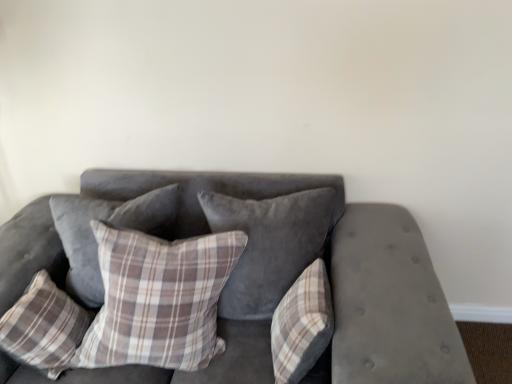
What do you see at coordinates (302, 325) in the screenshot? I see `plaid fabric pillow at center, positioned as the 1th pillow in right-to-left order` at bounding box center [302, 325].

The width and height of the screenshot is (512, 384). What do you see at coordinates (109, 225) in the screenshot?
I see `plaid fabric pillow at center, acting as the fourth pillow starting from the right` at bounding box center [109, 225].

What is the approximate height of velvet gray pillow at center, which is the fourth pillow from left to right?

The height of velvet gray pillow at center, which is the fourth pillow from left to right, is 44.44 centimeters.

The image size is (512, 384). Find the location of `plaid fabric pillow at center, the fifth pillow positioned from the left`. plaid fabric pillow at center, the fifth pillow positioned from the left is located at coordinates (302, 325).

From a real-world perspective, who is located lower, plaid fabric pillow at center, which appears as the 3th pillow when viewed from the left, or plaid fabric pillow at center, positioned as the 1th pillow in right-to-left order?

plaid fabric pillow at center, positioned as the 1th pillow in right-to-left order, from a real-world perspective.

Who is shorter, plaid fabric pillow at center, which is counted as the 3th pillow, starting from the right, or plaid fabric pillow at center, the fifth pillow positioned from the left?

plaid fabric pillow at center, the fifth pillow positioned from the left.

Is point (109, 306) closer or farther from the camera than point (278, 351)?

Point (109, 306) appears to be closer to the viewer than point (278, 351).

Are plaid fabric pillow at center, which is counted as the 3th pillow, starting from the right, and plaid fabric pillow at center, the fifth pillow positioned from the left, far apart?

They are positioned close to each other.

How much distance is there between velvet gray pillow at center, which is the fourth pillow from left to right, and plaid fabric pillow at center, which is the second pillow from left to right?

velvet gray pillow at center, which is the fourth pillow from left to right, is 15.20 inches away from plaid fabric pillow at center, which is the second pillow from left to right.

Does velvet gray pillow at center, the 2th pillow in the right-to-left sequence, have a smaller size compared to plaid fabric pillow at center, which is the second pillow from left to right?

Actually, velvet gray pillow at center, the 2th pillow in the right-to-left sequence, might be larger than plaid fabric pillow at center, which is the second pillow from left to right.

Would you say velvet gray pillow at center, which is the fourth pillow from left to right, is to the left or to the right of plaid fabric pillow at center, which is the second pillow from left to right, in the picture?

From the image, it's evident that velvet gray pillow at center, which is the fourth pillow from left to right, is to the right of plaid fabric pillow at center, which is the second pillow from left to right.

Where is `pillow that appears behind the velvet gray pillow at center, which is the fourth pillow from left to right`? Image resolution: width=512 pixels, height=384 pixels. pillow that appears behind the velvet gray pillow at center, which is the fourth pillow from left to right is located at coordinates (109, 225).

The width and height of the screenshot is (512, 384). In order to click on the 2nd pillow counting from the left of the velvet gray pillow at center, the 2th pillow in the right-to-left sequence in this screenshot , I will do `click(109, 225)`.

Which object is further away from the camera taking this photo, plaid fabric pillow at center, acting as the fourth pillow starting from the right, or velvet gray pillow at center, which is the fourth pillow from left to right?

plaid fabric pillow at center, acting as the fourth pillow starting from the right, is further away from the camera.

From the picture: Can you confirm if plaid fabric pillow at center, acting as the fourth pillow starting from the right, is wider than velvet gray pillow at center, which is the fourth pillow from left to right?

No.

Does plaid fabric pillow at center, which is the second pillow from left to right, have a smaller size compared to velvet gray pillow at center, the 2th pillow in the right-to-left sequence?

Indeed, plaid fabric pillow at center, which is the second pillow from left to right, has a smaller size compared to velvet gray pillow at center, the 2th pillow in the right-to-left sequence.

Is velvet gray pillow at center, the 2th pillow in the right-to-left sequence, at the right side of velvet gray couch at center?

Yes.

Is velvet gray pillow at center, which is the fourth pillow from left to right, taller or shorter than velvet gray couch at center?

Considering their sizes, velvet gray pillow at center, which is the fourth pillow from left to right, has less height than velvet gray couch at center.

From the picture: Is velvet gray pillow at center, the 2th pillow in the right-to-left sequence, smaller than velvet gray couch at center?

Yes, velvet gray pillow at center, the 2th pillow in the right-to-left sequence, is smaller than velvet gray couch at center.

Is plaid fabric pillow at lower left, acting as the fifth pillow starting from the right, thinner than velvet gray couch at center?

Correct, the width of plaid fabric pillow at lower left, acting as the fifth pillow starting from the right, is less than that of velvet gray couch at center.

Can you confirm if plaid fabric pillow at lower left, acting as the fifth pillow starting from the right, is positioned to the left of velvet gray couch at center?

Correct, you'll find plaid fabric pillow at lower left, acting as the fifth pillow starting from the right, to the left of velvet gray couch at center.

Who is bigger, plaid fabric pillow at lower left, which is the first pillow from left to right, or velvet gray couch at center?

velvet gray couch at center is bigger.

Is plaid fabric pillow at center, which appears as the 3th pillow when viewed from the left, aimed at velvet gray pillow at center, which is the fourth pillow from left to right?

No, plaid fabric pillow at center, which appears as the 3th pillow when viewed from the left, is not turned towards velvet gray pillow at center, which is the fourth pillow from left to right.

Can you tell me how much plaid fabric pillow at center, which is counted as the 3th pillow, starting from the right, and velvet gray pillow at center, which is the fourth pillow from left to right, differ in facing direction?

The angle between the facing direction of plaid fabric pillow at center, which is counted as the 3th pillow, starting from the right, and the facing direction of velvet gray pillow at center, which is the fourth pillow from left to right, is 2.79e-05 degrees.

Between plaid fabric pillow at center, which appears as the 3th pillow when viewed from the left, and velvet gray pillow at center, which is the fourth pillow from left to right, which one is positioned in front?

plaid fabric pillow at center, which appears as the 3th pillow when viewed from the left, is more forward.

Which is closer to the camera, (132, 321) or (322, 211)?

The point (132, 321) is in front.

Does velvet gray couch at center have a greater width compared to velvet gray pillow at center, the 2th pillow in the right-to-left sequence?

Yes, velvet gray couch at center is wider than velvet gray pillow at center, the 2th pillow in the right-to-left sequence.

Which of these two, velvet gray couch at center or velvet gray pillow at center, which is the fourth pillow from left to right, stands shorter?

With less height is velvet gray pillow at center, which is the fourth pillow from left to right.

Considering the relative sizes of velvet gray couch at center and velvet gray pillow at center, the 2th pillow in the right-to-left sequence, in the image provided, is velvet gray couch at center bigger than velvet gray pillow at center, the 2th pillow in the right-to-left sequence,?

Correct, velvet gray couch at center is larger in size than velvet gray pillow at center, the 2th pillow in the right-to-left sequence.

From a real-world perspective, starting from the plaid fabric pillow at center, the fifth pillow positioned from the left, which pillow is the 2nd one vertically above it? Please provide its 2D coordinates.

[(158, 299)]

At what (x,y) coordinates should I click in order to perform the action: click on the 2nd pillow counting from the left of the velvet gray pillow at center, which is the fourth pillow from left to right. Please return your answer as a coordinate pair (x, y). Looking at the image, I should click on (109, 225).

Looking at this image, when comparing their distances from plaid fabric pillow at center, positioned as the 1th pillow in right-to-left order, does plaid fabric pillow at center, which is counted as the 3th pillow, starting from the right, or velvet gray pillow at center, which is the fourth pillow from left to right, seem closer?

The object closer to plaid fabric pillow at center, positioned as the 1th pillow in right-to-left order, is velvet gray pillow at center, which is the fourth pillow from left to right.

From the image, which object appears to be nearer to plaid fabric pillow at center, which is counted as the 3th pillow, starting from the right, velvet gray pillow at center, which is the fourth pillow from left to right, or plaid fabric pillow at center, which is the second pillow from left to right?

velvet gray pillow at center, which is the fourth pillow from left to right, is positioned closer to the anchor plaid fabric pillow at center, which is counted as the 3th pillow, starting from the right.

Looking at the image, which one is located further to velvet gray couch at center, plaid fabric pillow at center, the fifth pillow positioned from the left, or plaid fabric pillow at center, which is the second pillow from left to right?

Among the two, plaid fabric pillow at center, which is the second pillow from left to right, is located further to velvet gray couch at center.

Based on their spatial positions, is plaid fabric pillow at center, the fifth pillow positioned from the left, or plaid fabric pillow at lower left, which is the first pillow from left to right, closer to velvet gray couch at center?

plaid fabric pillow at center, the fifth pillow positioned from the left, is positioned closer to the anchor velvet gray couch at center.

Which object lies nearer to the anchor point plaid fabric pillow at lower left, which is the first pillow from left to right, plaid fabric pillow at center, the fifth pillow positioned from the left, or plaid fabric pillow at center, which is the second pillow from left to right?

Among the two, plaid fabric pillow at center, which is the second pillow from left to right, is located nearer to plaid fabric pillow at lower left, which is the first pillow from left to right.

Based on their spatial positions, is velvet gray pillow at center, which is the fourth pillow from left to right, or plaid fabric pillow at lower left, acting as the fifth pillow starting from the right, further from velvet gray couch at center?

plaid fabric pillow at lower left, acting as the fifth pillow starting from the right.

Looking at the image, which one is located closer to plaid fabric pillow at center, acting as the fourth pillow starting from the right, plaid fabric pillow at center, which appears as the 3th pillow when viewed from the left, or plaid fabric pillow at lower left, acting as the fifth pillow starting from the right?

plaid fabric pillow at lower left, acting as the fifth pillow starting from the right, lies closer to plaid fabric pillow at center, acting as the fourth pillow starting from the right, than the other object.

Based on their spatial positions, is plaid fabric pillow at lower left, acting as the fifth pillow starting from the right, or plaid fabric pillow at center, which is the second pillow from left to right, further from plaid fabric pillow at center, the fifth pillow positioned from the left?

The object further to plaid fabric pillow at center, the fifth pillow positioned from the left, is plaid fabric pillow at lower left, acting as the fifth pillow starting from the right.

Image resolution: width=512 pixels, height=384 pixels. Find the location of `studio couch between plaid fabric pillow at center, acting as the fourth pillow starting from the right, and plaid fabric pillow at center, positioned as the 1th pillow in right-to-left order, from left to right`. studio couch between plaid fabric pillow at center, acting as the fourth pillow starting from the right, and plaid fabric pillow at center, positioned as the 1th pillow in right-to-left order, from left to right is located at coordinates (340, 275).

Identify the location of studio couch situated between plaid fabric pillow at center, which is the second pillow from left to right, and velvet gray pillow at center, which is the fourth pillow from left to right, from left to right. (340, 275).

Locate an element on the screen. The height and width of the screenshot is (384, 512). pillow between plaid fabric pillow at center, which is counted as the 3th pillow, starting from the right, and plaid fabric pillow at center, positioned as the 1th pillow in right-to-left order is located at coordinates (268, 245).

Find the location of a particular element. pillow located between plaid fabric pillow at center, acting as the fourth pillow starting from the right, and velvet gray pillow at center, which is the fourth pillow from left to right, in the left-right direction is located at coordinates (158, 299).